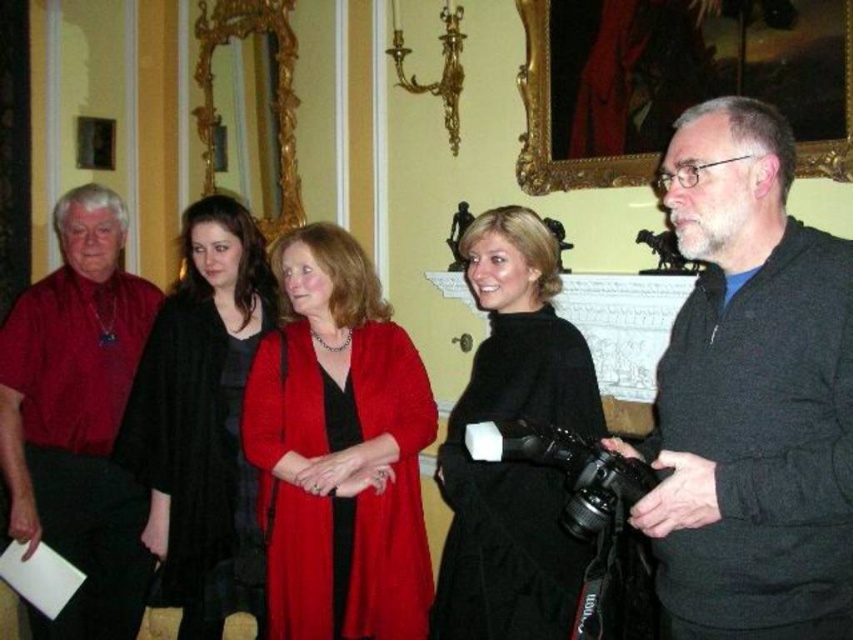
In the scene shown: You are a photographer who needs to adjust the camera focus between the dark gray sweater at right and the black woolen coat at center. Which object is closer to the camera?

The dark gray sweater at right is closer to the camera than the black woolen coat at center since they are 6.69 feet apart.

Looking at this image, you are a photographer trying to capture a photo of the dark gray sweater at right and the matte red shirt at left. Which object is positioned higher in the image?

The dark gray sweater at right is located above the matte red shirt at left, so it is positioned higher in the image.